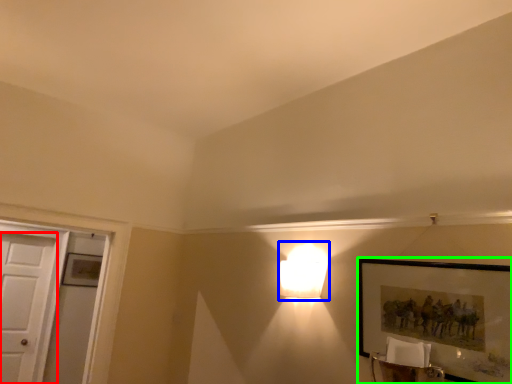
Question: Which object is the farthest from door (highlighted by a red box)? Choose among these: lamp (highlighted by a blue box) or picture frame (highlighted by a green box).

Choices:
 (A) lamp
 (B) picture frame

Answer: (B)